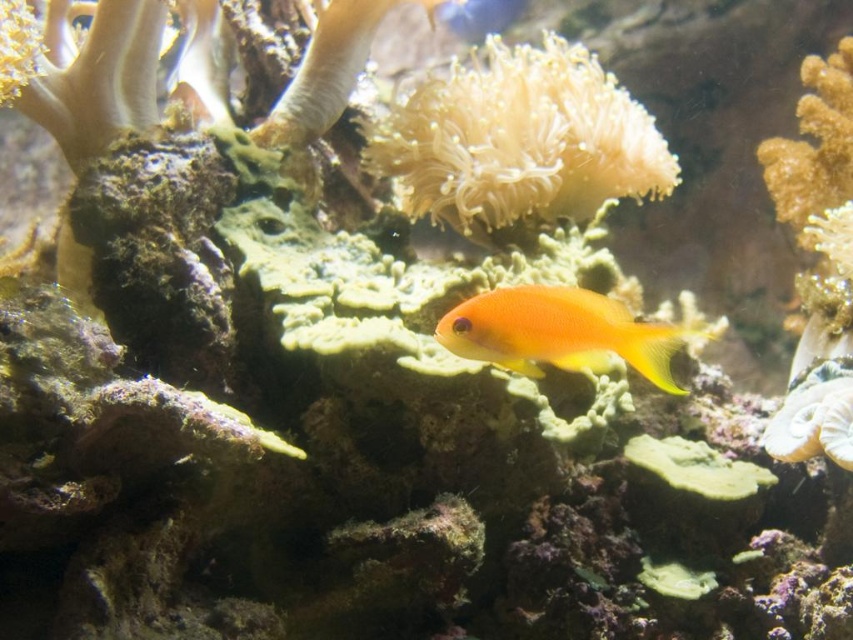
Is the position of soft white coral at center more distant than that of bright orange fish at center?

That is True.

Who is higher up, soft white coral at center or bright orange fish at center?

soft white coral at center is above.

Is point (376, 170) closer to viewer compared to point (537, 376)?

No, it is not.

The image size is (853, 640). In order to click on soft white coral at center in this screenshot , I will do `click(520, 140)`.